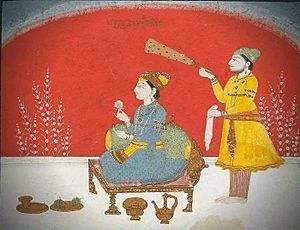
Locate an element on the screen. Image resolution: width=300 pixels, height=230 pixels. grey ceiling is located at coordinates (283, 17), (21, 3).